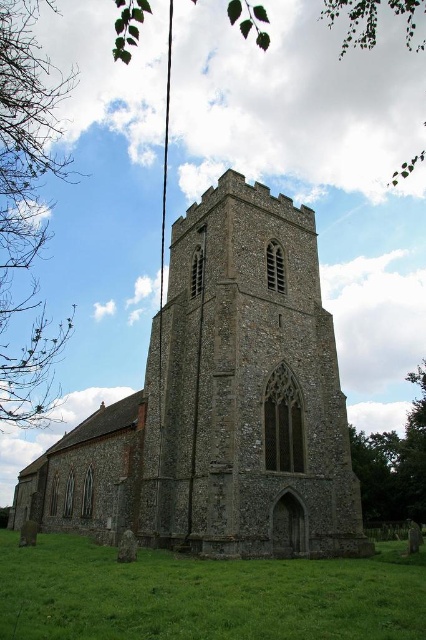
Question: Is stone church at center to the left of green grass at lower center from the viewer's perspective?

Choices:
 (A) yes
 (B) no

Answer: (A)

Question: From the image, what is the correct spatial relationship of stone church at center in relation to green grass at lower center?

Choices:
 (A) left
 (B) right

Answer: (A)

Question: Which point is farther from the camera taking this photo?

Choices:
 (A) (288, 298)
 (B) (397, 584)

Answer: (A)

Question: Which object is closer to the camera taking this photo?

Choices:
 (A) green grass at lower center
 (B) stone church at center

Answer: (A)

Question: Observing the image, what is the correct spatial positioning of stone church at center in reference to green grass at lower center?

Choices:
 (A) above
 (B) below

Answer: (A)

Question: Which object appears closest to the camera in this image?

Choices:
 (A) stone church at center
 (B) green grass at lower center

Answer: (B)